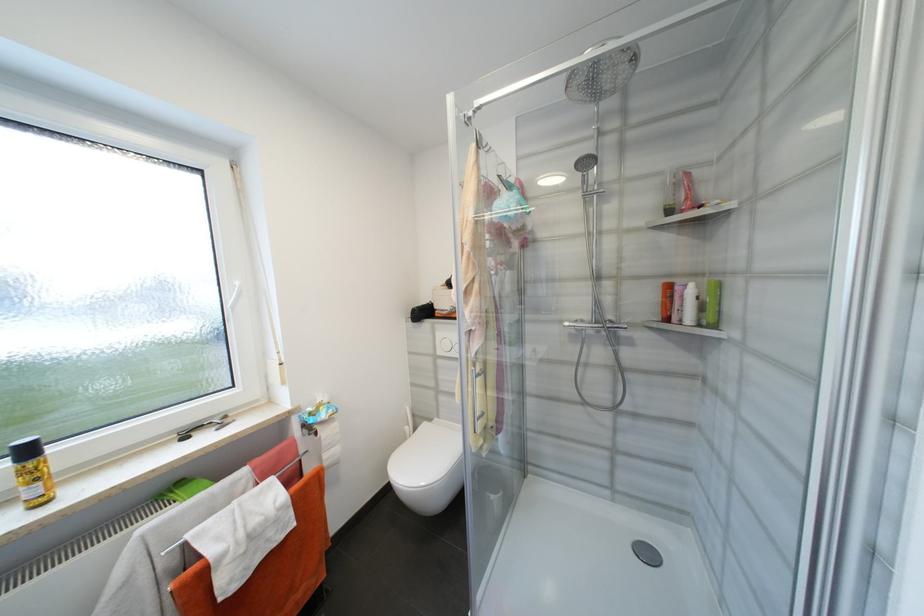
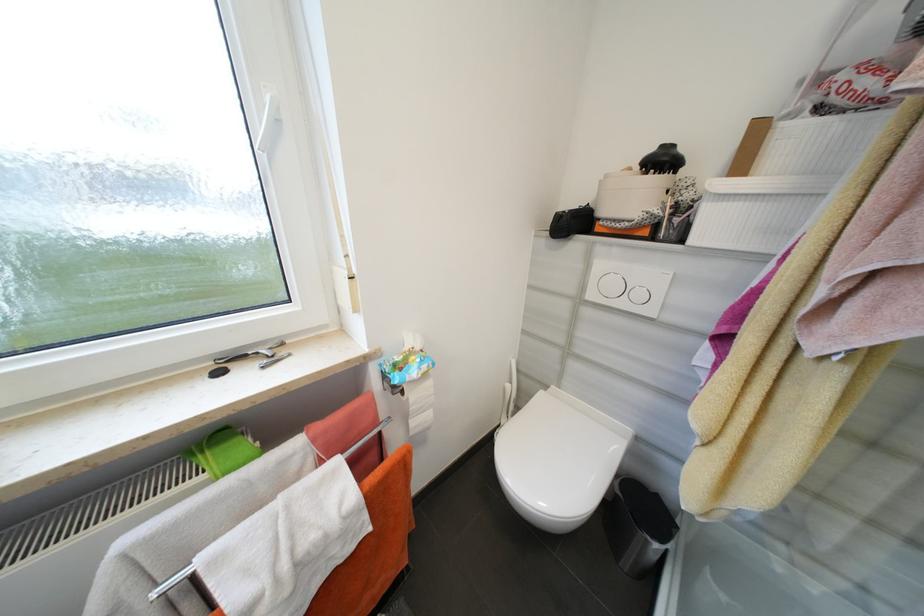
In a continuous first-person perspective shot, in which direction is the camera moving?

The cameraman walked toward left, forward.